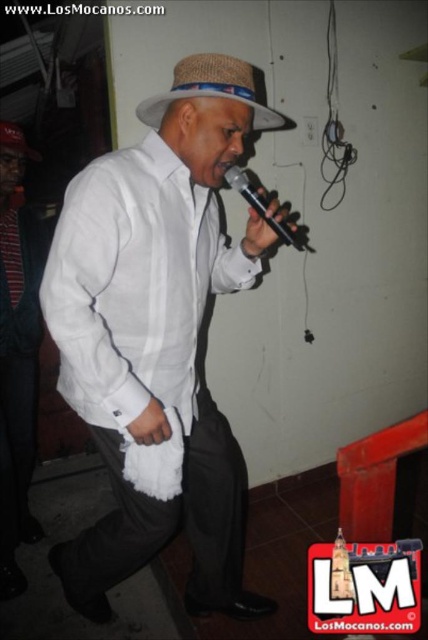
Question: Can you confirm if black plastic microphone at center is smaller than woven straw fedora at upper center?

Choices:
 (A) yes
 (B) no

Answer: (A)

Question: Which of the following is the closest to the observer?

Choices:
 (A) (264, 204)
 (B) (243, 61)
 (C) (2, 120)
 (D) (92, 541)

Answer: (B)

Question: Does woven straw hat at center have a smaller size compared to woven straw fedora at upper center?

Choices:
 (A) no
 (B) yes

Answer: (B)

Question: Among these points, which one is nearest to the camera?

Choices:
 (A) (246, 189)
 (B) (184, 90)
 (C) (190, 304)
 (D) (30, 154)

Answer: (B)

Question: Among these objects, which one is farthest from the camera?

Choices:
 (A) white matte shirt at center
 (B) black plastic microphone at center
 (C) woven straw fedora at upper center
 (D) woven straw hat at center

Answer: (C)

Question: Is black plastic microphone at center bigger than woven straw fedora at upper center?

Choices:
 (A) no
 (B) yes

Answer: (A)